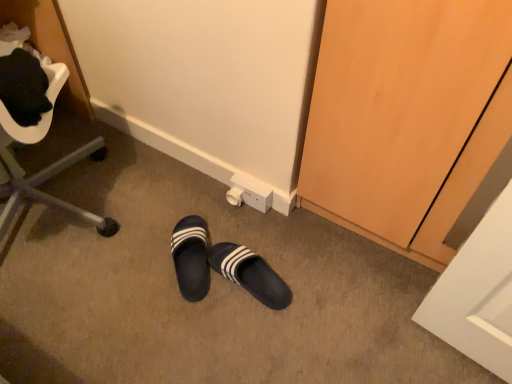
Question: From a real-world perspective, is metallic silver chair at left positioned above or below black rubber slippers at center?

Choices:
 (A) above
 (B) below

Answer: (A)

Question: Is metallic silver chair at left inside or outside of black rubber slippers at center?

Choices:
 (A) inside
 (B) outside

Answer: (B)

Question: Which object is the closest to the metallic silver chair at left?

Choices:
 (A) black rubber slippers at center
 (B) black leather slippers at center

Answer: (B)

Question: Estimate the real-world distances between objects in this image. Which object is closer to the black leather slippers at center?

Choices:
 (A) black rubber slippers at center
 (B) metallic silver chair at left

Answer: (A)